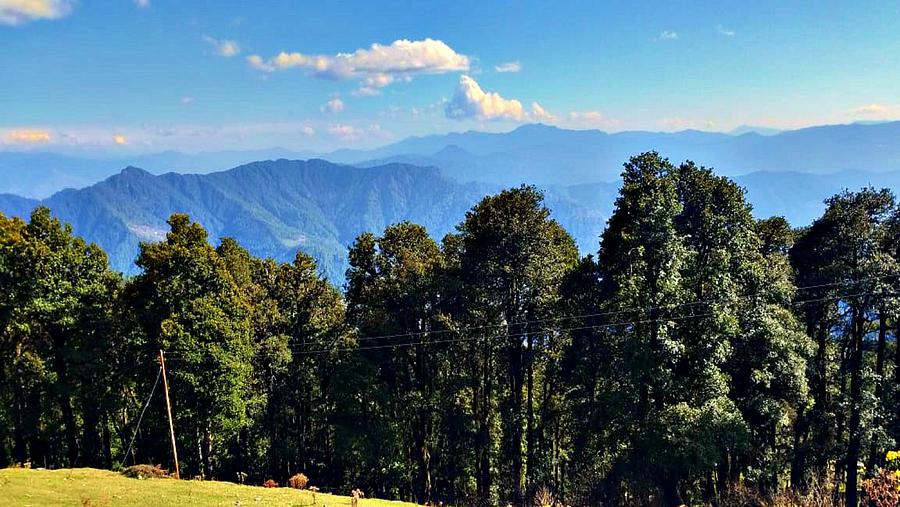
Identify the location of stand. point(158,424).